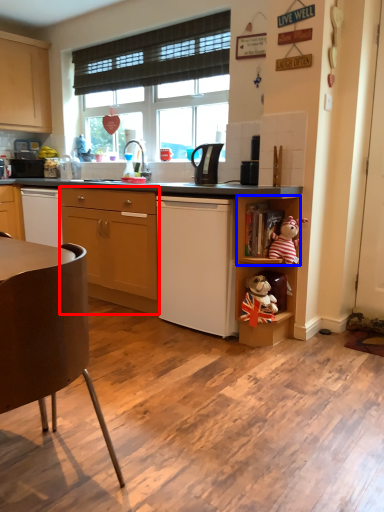
Question: Which object appears closest to the camera in this image, cabinetry (highlighted by a red box) or shelf (highlighted by a blue box)?

Choices:
 (A) cabinetry
 (B) shelf

Answer: (B)